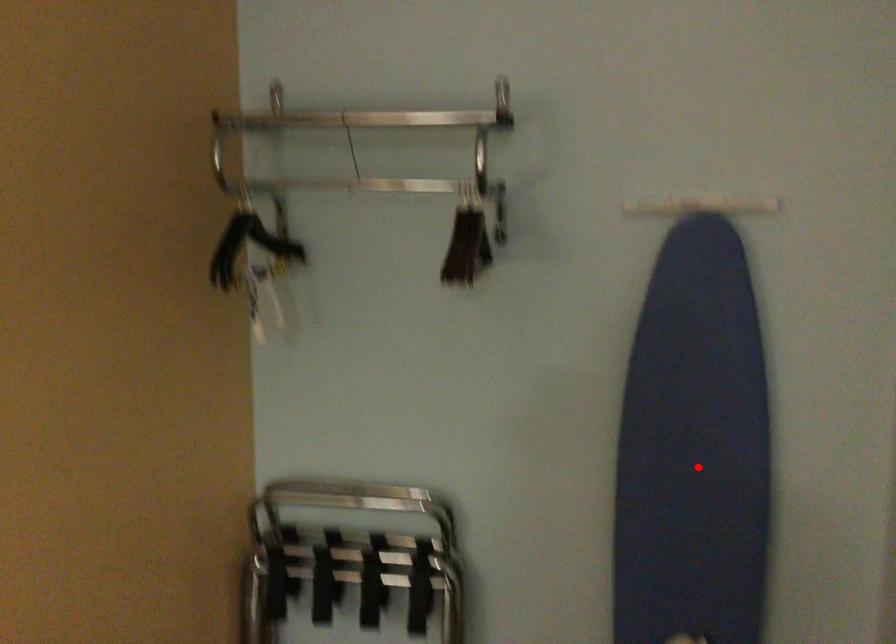
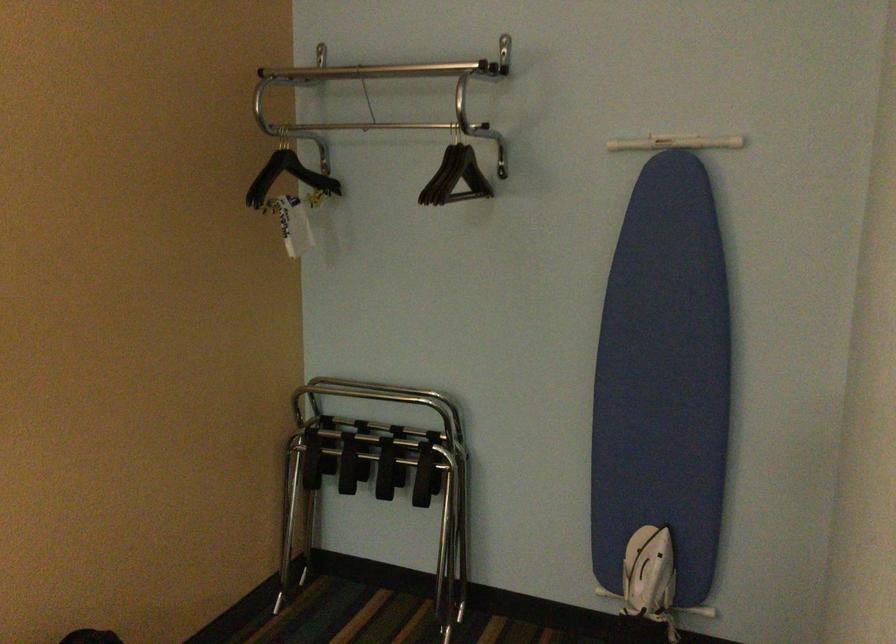
The point at the highlighted location is marked in the first image. Where is the corresponding point in the second image?

(662, 379)